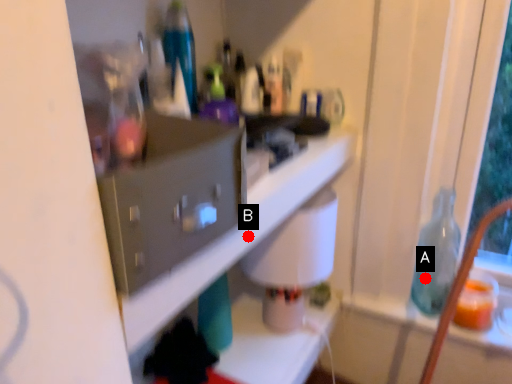
Question: Two points are circled on the image, labeled by A and B beside each circle. Which point appears farthest from the camera in this image?

Choices:
 (A) A is further
 (B) B is further

Answer: (A)